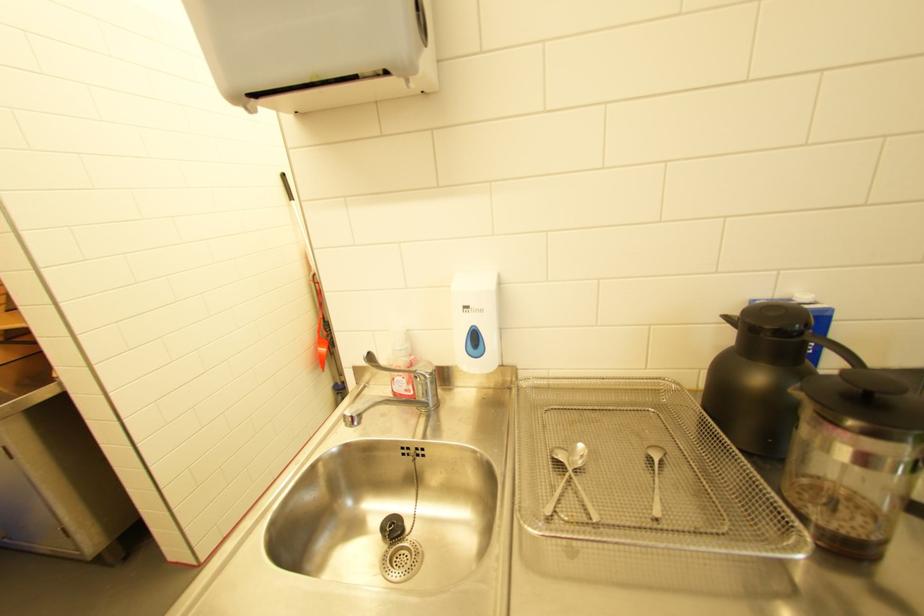
The width and height of the screenshot is (924, 616). I want to click on soap pump handle, so click(x=396, y=331).